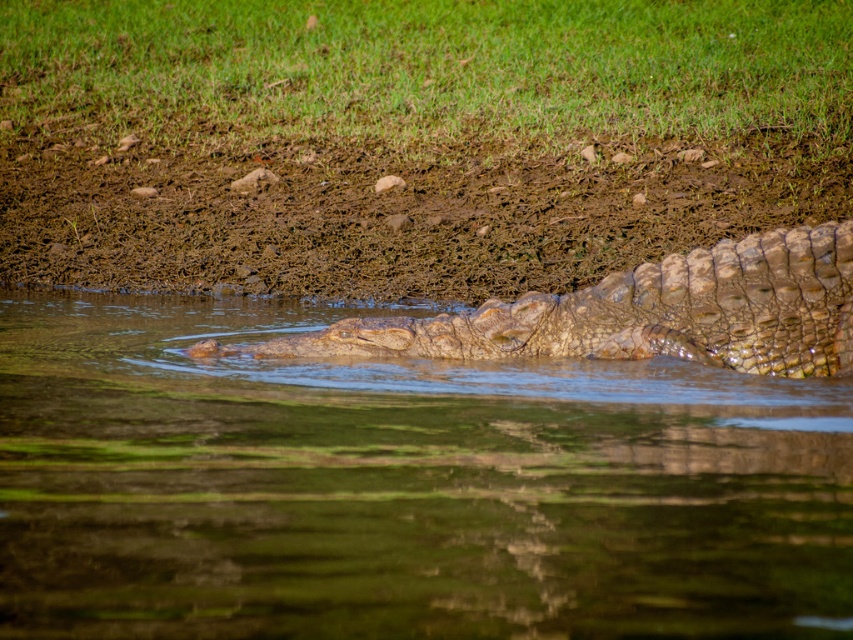
Can you confirm if greenish water at center is taller than leathery brown crocodile at center?

No.

Does greenish water at center appear on the left side of leathery brown crocodile at center?

Yes, greenish water at center is to the left of leathery brown crocodile at center.

I want to click on greenish water at center, so click(x=401, y=486).

Can you confirm if brown textured mud at center is taller than leathery brown crocodile at center?

Indeed, brown textured mud at center has a greater height compared to leathery brown crocodile at center.

Between point (155, 154) and point (659, 278), which one is positioned in front?

Positioned in front is point (659, 278).

What do you see at coordinates (389, 209) in the screenshot?
I see `brown textured mud at center` at bounding box center [389, 209].

Where is `brown textured mud at center`? brown textured mud at center is located at coordinates (389, 209).

Which is in front, point (427, 556) or point (135, 148)?

Point (427, 556) is more forward.

Does point (82, 416) come behind point (477, 182)?

No, it is in front of (477, 182).

I want to click on greenish water at center, so click(401, 486).